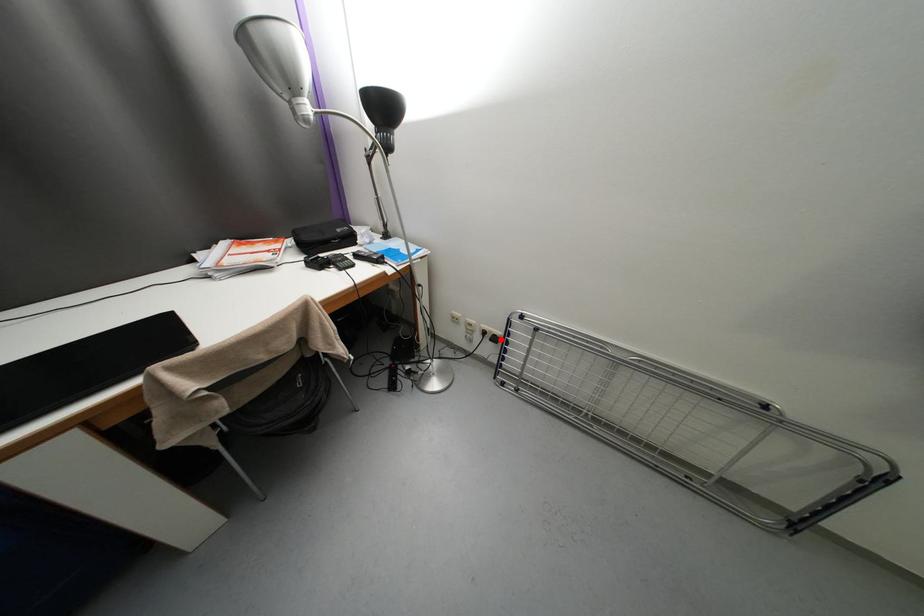
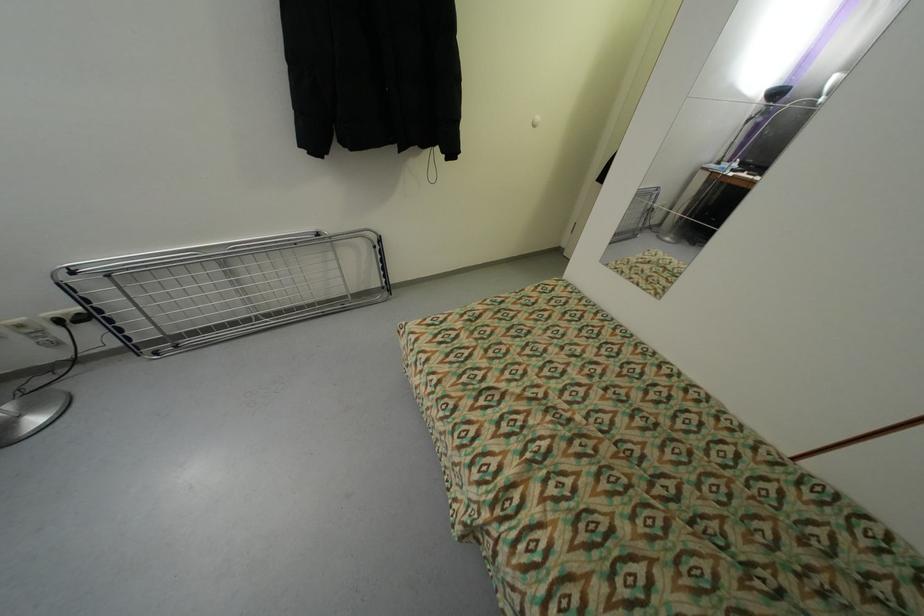
Locate, in the second image, the point that corresponds to the highlighted location in the first image.

(89, 320)